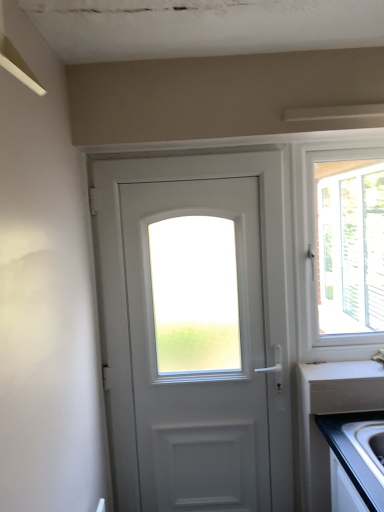
What do you see at coordinates (341, 370) in the screenshot? The width and height of the screenshot is (384, 512). I see `white laminate countertop at lower right` at bounding box center [341, 370].

Find the location of a particular element. white plastic window at right is located at coordinates (343, 249).

Describe the element at coordinates (264, 297) in the screenshot. I see `white matte door at center` at that location.

Where is `white laminate countertop at lower right`? This screenshot has width=384, height=512. white laminate countertop at lower right is located at coordinates (341, 370).

From a real-world perspective, is silver metallic faucet at right physically below white plastic window at right?

Indeed, from a real-world perspective, silver metallic faucet at right is positioned beneath white plastic window at right.

Consider the image. Considering the relative sizes of silver metallic faucet at right and white plastic window at right in the image provided, is silver metallic faucet at right taller than white plastic window at right?

No, silver metallic faucet at right is not taller than white plastic window at right.

Considering the positions of objects silver metallic faucet at right and white plastic window at right in the image provided, who is more to the left, silver metallic faucet at right or white plastic window at right?

Positioned to the left is white plastic window at right.

Considering the sizes of objects silver metallic faucet at right and white laminate countertop at lower right in the image provided, who is taller, silver metallic faucet at right or white laminate countertop at lower right?

silver metallic faucet at right is taller.

Is silver metallic faucet at right bigger or smaller than white laminate countertop at lower right?

Clearly, silver metallic faucet at right is larger in size than white laminate countertop at lower right.

Identify the location of faucet that is above the white laminate countertop at lower right (from the image's perspective). (379, 356).

Considering the relative positions of silver metallic faucet at right and white laminate countertop at lower right in the image provided, is silver metallic faucet at right to the right of white laminate countertop at lower right from the viewer's perspective?

Indeed, silver metallic faucet at right is positioned on the right side of white laminate countertop at lower right.

Which is more to the right, white plastic window at right or silver metallic faucet at right?

Result: From the viewer's perspective, silver metallic faucet at right appears more on the right side.

Is the position of white plastic window at right less distant than that of silver metallic faucet at right?

No, white plastic window at right is behind silver metallic faucet at right.

From the picture: Is white plastic window at right looking in the opposite direction of silver metallic faucet at right?

That's not correct — white plastic window at right is not looking away from silver metallic faucet at right.

Is white plastic window at right shorter than silver metallic faucet at right?

No.

Where is `door above the white laminate countertop at lower right (from a real-world perspective)`? door above the white laminate countertop at lower right (from a real-world perspective) is located at coordinates (264, 297).

Is white laminate countertop at lower right to the left of white matte door at center from the viewer's perspective?

No.

Which object is closer to the camera taking this photo, white laminate countertop at lower right or white matte door at center?

white matte door at center is more forward.

Is point (249, 170) positioned before point (334, 207)?

Yes.

Would you say white matte door at center is a long distance from white plastic window at right?

Yes.

From the image's perspective, does white matte door at center appear higher than white plastic window at right?

No, from the image's perspective, white matte door at center is not above white plastic window at right.

Do you think silver metallic faucet at right is within white matte door at center, or outside of it?

The correct answer is: outside.

Which of these two, silver metallic faucet at right or white matte door at center, stands taller?

white matte door at center.

Which of these two, silver metallic faucet at right or white matte door at center, is thinner?

white matte door at center.

Considering the sizes of silver metallic faucet at right and white matte door at center in the image, is silver metallic faucet at right bigger or smaller than white matte door at center?

Clearly, silver metallic faucet at right is smaller in size than white matte door at center.

Does white plastic window at right turn towards white laminate countertop at lower right?

Yes, white plastic window at right is facing white laminate countertop at lower right.

Considering the relative sizes of white plastic window at right and white laminate countertop at lower right in the image provided, is white plastic window at right shorter than white laminate countertop at lower right?

No, white plastic window at right is not shorter than white laminate countertop at lower right.

Is white plastic window at right positioned before white laminate countertop at lower right?

No, the depth of white plastic window at right is greater than that of white laminate countertop at lower right.

Considering the relative sizes of white plastic window at right and white laminate countertop at lower right in the image provided, is white plastic window at right bigger than white laminate countertop at lower right?

Indeed, white plastic window at right has a larger size compared to white laminate countertop at lower right.

Identify the location of faucet that appears in front of the white plastic window at right. This screenshot has height=512, width=384. (379, 356).

The width and height of the screenshot is (384, 512). I want to click on faucet lying above the white laminate countertop at lower right (from the image's perspective), so click(379, 356).

When comparing their distances from silver metallic faucet at right, does white laminate countertop at lower right or white plastic window at right seem further?

white plastic window at right lies further to silver metallic faucet at right than the other object.

From the image, which object appears to be farther from white plastic window at right, silver metallic faucet at right or white matte door at center?

The object further to white plastic window at right is silver metallic faucet at right.

Estimate the real-world distances between objects in this image. Which object is closer to white matte door at center, silver metallic faucet at right or white plastic window at right?

silver metallic faucet at right.

From the image, which object appears to be farther from white laminate countertop at lower right, white plastic window at right or silver metallic faucet at right?

white plastic window at right.

From the image, which object appears to be farther from silver metallic faucet at right, white laminate countertop at lower right or white matte door at center?

white matte door at center.

Based on their spatial positions, is white laminate countertop at lower right or white matte door at center closer to white plastic window at right?

white laminate countertop at lower right is positioned closer to the anchor white plastic window at right.

When comparing their distances from white plastic window at right, does white matte door at center or white laminate countertop at lower right seem further?

white matte door at center.

Estimate the real-world distances between objects in this image. Which object is further from white matte door at center, white plastic window at right or silver metallic faucet at right?

white plastic window at right is positioned further to the anchor white matte door at center.

Image resolution: width=384 pixels, height=512 pixels. I want to click on counter top between white matte door at center and silver metallic faucet at right, so click(341, 370).

Identify the location of window between white matte door at center and white laminate countertop at lower right. coord(343,249).

At what (x,y) coordinates should I click in order to perform the action: click on faucet between white plastic window at right and white laminate countertop at lower right in the vertical direction. Please return your answer as a coordinate pair (x, y). The height and width of the screenshot is (512, 384). Looking at the image, I should click on (379, 356).

The height and width of the screenshot is (512, 384). I want to click on window between white matte door at center and silver metallic faucet at right from left to right, so 343,249.